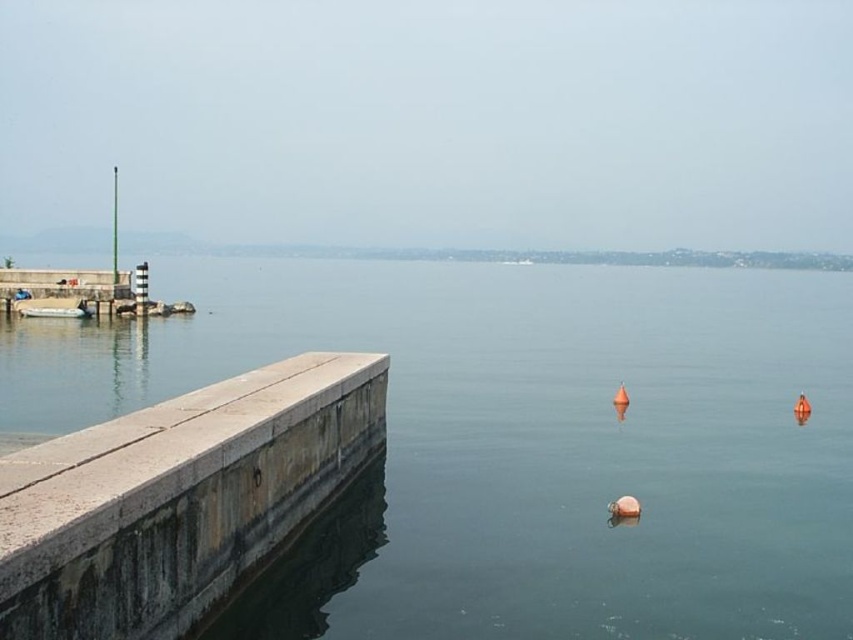
Can you confirm if transparent water at center is positioned to the left of concrete ledge at left?

No, transparent water at center is not to the left of concrete ledge at left.

Image resolution: width=853 pixels, height=640 pixels. What are the coordinates of `transparent water at center` in the screenshot? It's located at click(x=520, y=442).

Which is more to the left, transparent water at center or white rubber boat at left?

Positioned to the left is white rubber boat at left.

Identify the location of transparent water at center. (520, 442).

Can you confirm if concrete ledge at left is positioned below white rubber boat at left?

Yes, concrete ledge at left is below white rubber boat at left.

Is point (177, 627) farther from camera compared to point (18, 305)?

No.

The width and height of the screenshot is (853, 640). In order to click on concrete ledge at left in this screenshot , I will do `click(178, 499)`.